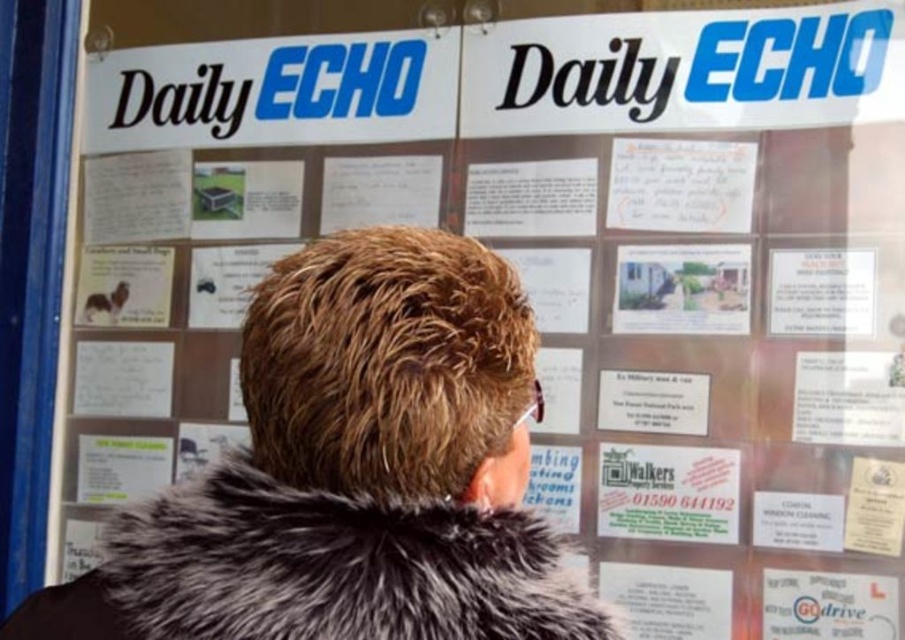
Which of these two, brown fur coat at center or fuzzy gray fur coat at center, stands shorter?

fuzzy gray fur coat at center is shorter.

Is point (526, 372) less distant than point (593, 614)?

Yes, it is.

In the scene shown: Who is more distant from viewer, (x=451, y=300) or (x=329, y=522)?

Point (x=451, y=300)

Where is `brown fur coat at center`? Image resolution: width=905 pixels, height=640 pixels. brown fur coat at center is located at coordinates (353, 472).